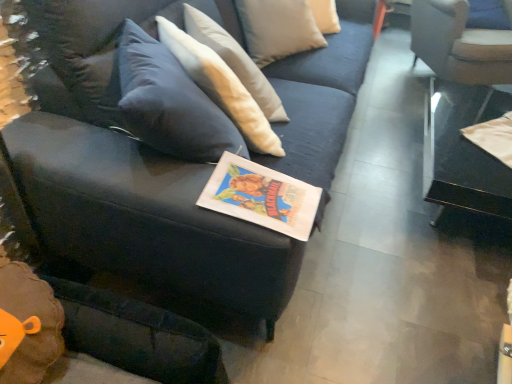
Identify the location of velvet dark blue couch at center. This screenshot has height=384, width=512. [142, 213].

The width and height of the screenshot is (512, 384). What do you see at coordinates (261, 196) in the screenshot?
I see `matte paper book at center` at bounding box center [261, 196].

The width and height of the screenshot is (512, 384). Describe the element at coordinates (459, 44) in the screenshot. I see `white fabric chair at upper right` at that location.

Find the location of a particular element. This screenshot has width=512, height=384. velvet dark blue couch at center is located at coordinates (142, 213).

From a real-world perspective, relative to matte paper book at center, is white fabric chair at upper right vertically above or below?

white fabric chair at upper right is below matte paper book at center.

Which point is more distant from viewer, (x=428, y=7) or (x=237, y=159)?

The point (x=428, y=7) is more distant.

Consider the image. From the image's perspective, is white fabric chair at upper right positioned above or below matte paper book at center?

From the image's perspective, white fabric chair at upper right appears above matte paper book at center.

Consider the image. Who is shorter, white fabric chair at upper right or matte paper book at center?

matte paper book at center.

Would you consider transparent glass table at right to be distant from velvet dark blue couch at center?

Yes, transparent glass table at right and velvet dark blue couch at center are quite far apart.

What's the angular difference between transparent glass table at right and velvet dark blue couch at center's facing directions?

The angular difference between transparent glass table at right and velvet dark blue couch at center is 120 degrees.

From the image's perspective, which is above, transparent glass table at right or velvet dark blue couch at center?

velvet dark blue couch at center.

Does transparent glass table at right appear on the right side of velvet dark blue couch at center?

Correct, you'll find transparent glass table at right to the right of velvet dark blue couch at center.

Is velvet dark blue couch at center facing away from white fabric chair at upper right?

velvet dark blue couch at center does not have its back to white fabric chair at upper right.

How distant is velvet dark blue couch at center from white fabric chair at upper right?

velvet dark blue couch at center is 1.97 meters away from white fabric chair at upper right.

How different are the orientations of velvet dark blue couch at center and white fabric chair at upper right in degrees?

The angle between the facing direction of velvet dark blue couch at center and the facing direction of white fabric chair at upper right is 92.3 degrees.

Is point (115, 212) farther from camera compared to point (483, 51)?

No, (115, 212) is in front of (483, 51).

Between transparent glass table at right and matte paper book at center, which one has smaller size?

matte paper book at center is smaller.

How many degrees apart are the facing directions of transparent glass table at right and matte paper book at center?

transparent glass table at right and matte paper book at center are facing 91.1 degrees away from each other.

Considering the positions of point (463, 93) and point (217, 189), is point (463, 93) closer or farther from the camera than point (217, 189)?

Point (463, 93) is farther from the camera than point (217, 189).

In the scene shown: Is transparent glass table at right not within matte paper book at center?

Yes, transparent glass table at right is not within matte paper book at center.

Are matte paper book at center and velvet dark blue couch at center located far from each other?

No.

Does matte paper book at center have a greater height compared to velvet dark blue couch at center?

No.

Based on their sizes in the image, would you say matte paper book at center is bigger or smaller than velvet dark blue couch at center?

matte paper book at center is smaller than velvet dark blue couch at center.

Which object is closer to the camera taking this photo, matte paper book at center or velvet dark blue couch at center?

velvet dark blue couch at center is closer to the camera.

Looking at the image, does white fabric chair at upper right seem bigger or smaller compared to velvet dark blue couch at center?

Considering their sizes, white fabric chair at upper right takes up less space than velvet dark blue couch at center.

From a real-world perspective, relative to velvet dark blue couch at center, is white fabric chair at upper right vertically above or below?

From a real-world perspective, white fabric chair at upper right is physically below velvet dark blue couch at center.

Does white fabric chair at upper right have a lesser height compared to velvet dark blue couch at center?

Correct, white fabric chair at upper right is not as tall as velvet dark blue couch at center.

How many degrees apart are the facing directions of white fabric chair at upper right and velvet dark blue couch at center?

They differ by 92.3 degrees in their facing directions.

From the image's perspective, between matte paper book at center and transparent glass table at right, who is located below?

matte paper book at center, from the image's perspective.

Who is bigger, matte paper book at center or transparent glass table at right?

transparent glass table at right.

From the picture: Is matte paper book at center not close to transparent glass table at right?

Yes, matte paper book at center and transparent glass table at right are located far from each other.

Where is `chair that appears above the matte paper book at center (from the image's perspective)`? chair that appears above the matte paper book at center (from the image's perspective) is located at coordinates (459, 44).

Where is `table behind the velvet dark blue couch at center`? table behind the velvet dark blue couch at center is located at coordinates (463, 151).

From the image, which object appears to be nearer to white fabric chair at upper right, transparent glass table at right or velvet dark blue couch at center?

Based on the image, transparent glass table at right appears to be nearer to white fabric chair at upper right.

In the scene shown: Which object lies further to the anchor point white fabric chair at upper right, matte paper book at center or velvet dark blue couch at center?

matte paper book at center lies further to white fabric chair at upper right than the other object.

When comparing their distances from white fabric chair at upper right, does matte paper book at center or transparent glass table at right seem further?

Based on the image, matte paper book at center appears to be further to white fabric chair at upper right.

Considering their positions, is velvet dark blue couch at center positioned further to matte paper book at center than transparent glass table at right?

transparent glass table at right is further to matte paper book at center.

Looking at the image, which one is located further to velvet dark blue couch at center, matte paper book at center or white fabric chair at upper right?

white fabric chair at upper right is positioned further to the anchor velvet dark blue couch at center.

When comparing their distances from transparent glass table at right, does velvet dark blue couch at center or matte paper book at center seem further?

velvet dark blue couch at center.

Estimate the real-world distances between objects in this image. Which object is closer to matte paper book at center, velvet dark blue couch at center or white fabric chair at upper right?

velvet dark blue couch at center is closer to matte paper book at center.

Based on their spatial positions, is matte paper book at center or velvet dark blue couch at center further from transparent glass table at right?

velvet dark blue couch at center is positioned further to the anchor transparent glass table at right.

Locate an element on the screen. The image size is (512, 384). book between velvet dark blue couch at center and transparent glass table at right in the horizontal direction is located at coordinates (261, 196).

Identify the location of table between velvet dark blue couch at center and white fabric chair at upper right along the z-axis. This screenshot has width=512, height=384. (463, 151).

Where is `table located between matte paper book at center and white fabric chair at upper right in the depth direction`? The width and height of the screenshot is (512, 384). table located between matte paper book at center and white fabric chair at upper right in the depth direction is located at coordinates (463, 151).

Locate an element on the screen. book between velvet dark blue couch at center and white fabric chair at upper right from front to back is located at coordinates (261, 196).